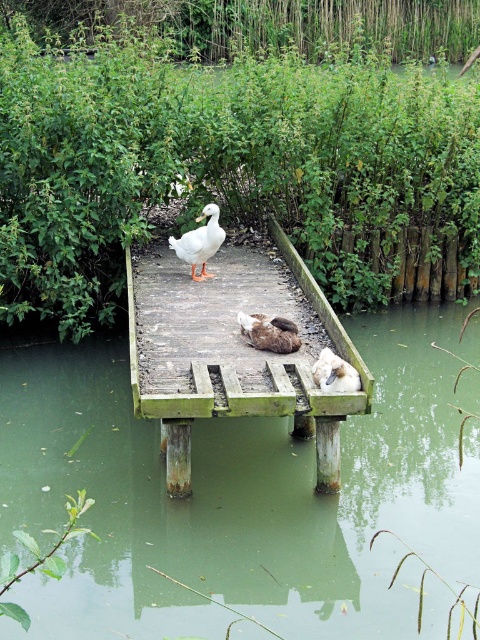
Question: Which of the following is the farthest from the observer?

Choices:
 (A) (205, 211)
 (B) (247, 330)
 (C) (344, 362)

Answer: (A)

Question: Which point is farther from the camera taking this photo?

Choices:
 (A) (331, 371)
 (B) (365, 404)

Answer: (A)

Question: Estimate the real-world distances between objects in this image. Which object is closer to the brown fuzzy duck at center?

Choices:
 (A) white matte duck at center
 (B) wooden dock at center
 (C) white fluffy duck at center
 (D) greenish murky water at center

Answer: (C)

Question: Can you confirm if greenish murky water at center is positioned to the right of white matte duck at center?

Choices:
 (A) no
 (B) yes

Answer: (B)

Question: Does wooden dock at center have a larger size compared to white matte duck at center?

Choices:
 (A) yes
 (B) no

Answer: (A)

Question: Can you confirm if wooden dock at center is positioned below brown fuzzy duck at center?

Choices:
 (A) yes
 (B) no

Answer: (B)